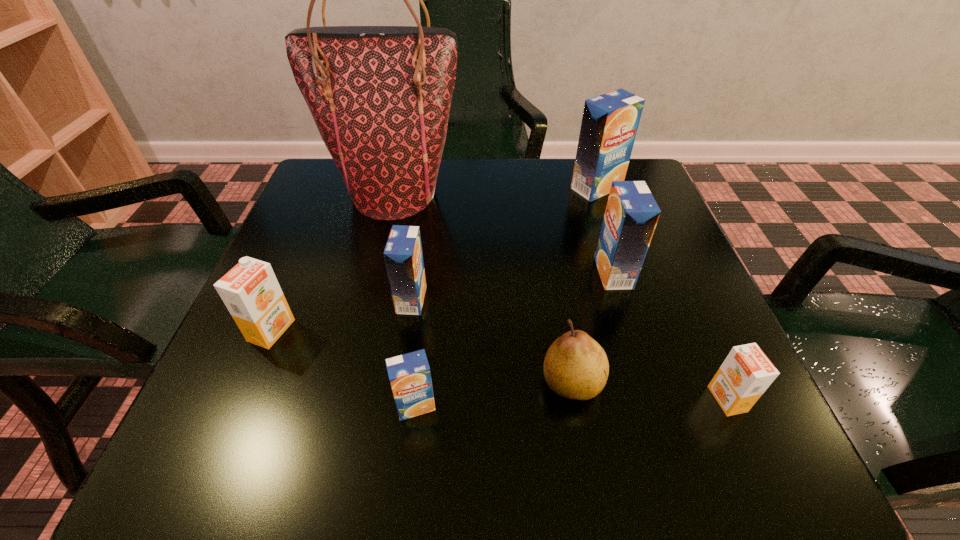
Image resolution: width=960 pixels, height=540 pixels. I want to click on vacant space at the left edge of the desktop, so click(x=313, y=299).

This screenshot has height=540, width=960. I want to click on vacant region at the right edge, so click(719, 345).

In the image, there is a desktop. At what (x,y) coordinates should I click in order to perform the action: click on vacant space at the near left corner. Please return your answer as a coordinate pair (x, y). The image size is (960, 540). Looking at the image, I should click on (248, 455).

This screenshot has height=540, width=960. Find the location of `vacant area between the right orange orange juice and the smallest blue orange_juice`. vacant area between the right orange orange juice and the smallest blue orange_juice is located at coordinates (571, 402).

Locate an element on the screen. The width and height of the screenshot is (960, 540). free space between the seventh shortest object and the nearest blue orange_juice is located at coordinates (506, 297).

Where is `vacant space that is in between the rightmost orange juice and the leftmost orange juice`? The image size is (960, 540). vacant space that is in between the rightmost orange juice and the leftmost orange juice is located at coordinates (499, 364).

Find the location of a particular element. This screenshot has height=540, width=960. free space that is in between the bigger orange orange juice and the third biggest blue orange_juice is located at coordinates (342, 315).

You are a GUI agent. You are given a task and a screenshot of the screen. Output one action in this format:
    pyautogui.click(x=<x>, y=<y>)
    Task: Click on the free spot between the third biggest blue orange_juice and the second tallest orange juice
    
    Given the screenshot: What is the action you would take?
    pyautogui.click(x=513, y=286)

You are a GUI agent. You are given a task and a screenshot of the screen. Output one action in this format:
    pyautogui.click(x=<x>, y=<y>)
    Task: Click on the unoccupied area between the brown pear and the handbag
    
    Given the screenshot: What is the action you would take?
    pyautogui.click(x=484, y=288)

Find the location of a particular element. The width and height of the screenshot is (960, 540). vacant area that lies between the fourth object from right to left and the biggest blue orange_juice is located at coordinates (585, 285).